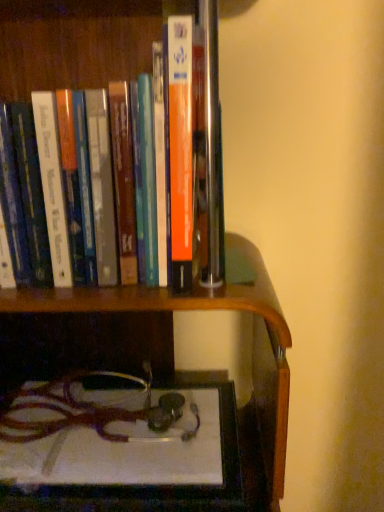
Question: Does orange matte book at upper center contain white glossy book at lower center?

Choices:
 (A) no
 (B) yes

Answer: (A)

Question: Does orange matte book at upper center have a lesser height compared to white glossy book at lower center?

Choices:
 (A) no
 (B) yes

Answer: (A)

Question: Does orange matte book at upper center appear on the right side of white glossy book at lower center?

Choices:
 (A) no
 (B) yes

Answer: (A)

Question: From the image's perspective, is orange matte book at upper center over white glossy book at lower center?

Choices:
 (A) yes
 (B) no

Answer: (A)

Question: Considering the relative sizes of orange matte book at upper center and white glossy book at lower center in the image provided, is orange matte book at upper center smaller than white glossy book at lower center?

Choices:
 (A) no
 (B) yes

Answer: (A)

Question: Is orange matte book at upper center thinner than white glossy book at lower center?

Choices:
 (A) yes
 (B) no

Answer: (A)

Question: Is white glossy book at lower center beside orange matte book at upper center?

Choices:
 (A) no
 (B) yes

Answer: (A)

Question: Is white glossy book at lower center facing towards orange matte book at upper center?

Choices:
 (A) no
 (B) yes

Answer: (A)

Question: Is white glossy book at lower center located outside orange matte book at upper center?

Choices:
 (A) yes
 (B) no

Answer: (A)

Question: Can you confirm if white glossy book at lower center is shorter than orange matte book at upper center?

Choices:
 (A) yes
 (B) no

Answer: (A)

Question: Does white glossy book at lower center come in front of orange matte book at upper center?

Choices:
 (A) no
 (B) yes

Answer: (A)

Question: From the image's perspective, is white glossy book at lower center under orange matte book at upper center?

Choices:
 (A) no
 (B) yes

Answer: (B)

Question: Considering the positions of white glossy book at lower center and orange matte book at upper center in the image, is white glossy book at lower center bigger or smaller than orange matte book at upper center?

Choices:
 (A) big
 (B) small

Answer: (B)